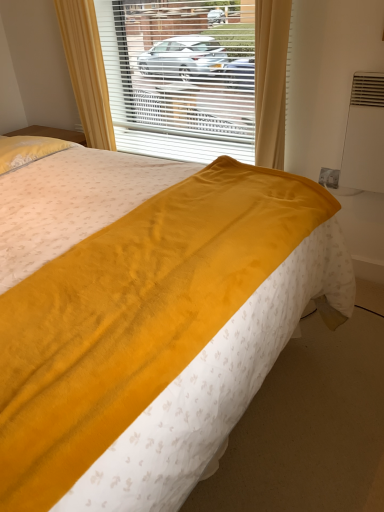
The height and width of the screenshot is (512, 384). What do you see at coordinates (146, 318) in the screenshot?
I see `velvet yellow blanket at center` at bounding box center [146, 318].

This screenshot has height=512, width=384. Identify the location of velvet yellow blanket at center. (146, 318).

This screenshot has width=384, height=512. What do you see at coordinates (271, 80) in the screenshot?
I see `white plastic blinds at center` at bounding box center [271, 80].

Find the location of a particular element. white plastic blinds at center is located at coordinates (271, 80).

The image size is (384, 512). I want to click on velvet yellow blanket at center, so click(x=146, y=318).

Would you say velvet yellow blanket at center is to the left or to the right of white plastic blinds at center in the picture?

velvet yellow blanket at center is positioned on white plastic blinds at center's left side.

Considering the positions of objects velvet yellow blanket at center and white plastic blinds at center in the image provided, who is in front, velvet yellow blanket at center or white plastic blinds at center?

velvet yellow blanket at center is in front.

Is point (101, 461) closer or farther from the camera than point (258, 61)?

Clearly, point (101, 461) is closer to the camera than point (258, 61).

From the image's perspective, is velvet yellow blanket at center under white plastic blinds at center?

Yes, from the image's perspective, velvet yellow blanket at center is below white plastic blinds at center.

From a real-world perspective, is velvet yellow blanket at center located beneath white plastic blinds at center?

Yes, from a real-world perspective, velvet yellow blanket at center is under white plastic blinds at center.

Between velvet yellow blanket at center and white plastic blinds at center, which one has smaller width?

Thinner between the two is white plastic blinds at center.

Considering the sizes of objects velvet yellow blanket at center and white plastic blinds at center in the image provided, who is taller, velvet yellow blanket at center or white plastic blinds at center?

With more height is velvet yellow blanket at center.

Does velvet yellow blanket at center have a smaller size compared to white plastic blinds at center?

No, velvet yellow blanket at center is not smaller than white plastic blinds at center.

Is velvet yellow blanket at center inside or outside of white plastic blinds at center?

velvet yellow blanket at center lies outside white plastic blinds at center.

Are velvet yellow blanket at center and white plastic blinds at center beside each other?

velvet yellow blanket at center is not next to white plastic blinds at center, and they're not touching.

Is velvet yellow blanket at center positioned with its back to white plastic blinds at center?

velvet yellow blanket at center does not have its back to white plastic blinds at center.

How many degrees apart are the facing directions of velvet yellow blanket at center and white plastic blinds at center?

The angle between the facing direction of velvet yellow blanket at center and the facing direction of white plastic blinds at center is 90 degrees.

Measure the distance between velvet yellow blanket at center and white plastic blinds at center.

The distance of velvet yellow blanket at center from white plastic blinds at center is 1.32 meters.

This screenshot has height=512, width=384. Identify the location of bed that appears below the white plastic blinds at center (from the image's perspective). (146, 318).

Does white plastic blinds at center appear on the left side of velvet yellow blanket at center?

Incorrect, white plastic blinds at center is not on the left side of velvet yellow blanket at center.

Which object is more forward, white plastic blinds at center or velvet yellow blanket at center?

velvet yellow blanket at center.

Does point (93, 87) lie behind point (209, 219)?

Yes.

From the image's perspective, is white plastic blinds at center above or below velvet yellow blanket at center?

Based on their image positions, white plastic blinds at center is located above velvet yellow blanket at center.

From a real-world perspective, relative to velvet yellow blanket at center, is white plastic blinds at center vertically above or below?

white plastic blinds at center is above velvet yellow blanket at center.

Which of these two, white plastic blinds at center or velvet yellow blanket at center, is thinner?

Thinner between the two is white plastic blinds at center.

In terms of height, does white plastic blinds at center look taller or shorter compared to velvet yellow blanket at center?

In the image, white plastic blinds at center appears to be shorter than velvet yellow blanket at center.

Which of these two, white plastic blinds at center or velvet yellow blanket at center, is smaller?

With smaller size is white plastic blinds at center.

Is white plastic blinds at center inside or outside of velvet yellow blanket at center?

white plastic blinds at center is not enclosed by velvet yellow blanket at center.

Is white plastic blinds at center not close to velvet yellow blanket at center?

Absolutely, white plastic blinds at center is distant from velvet yellow blanket at center.

In the scene shown: Is velvet yellow blanket at center at the back of white plastic blinds at center?

No.

How different are the orientations of white plastic blinds at center and velvet yellow blanket at center in degrees?

The angular difference between white plastic blinds at center and velvet yellow blanket at center is 90 degrees.

The image size is (384, 512). I want to click on bed located underneath the white plastic blinds at center (from a real-world perspective), so click(146, 318).

Locate an element on the screen. Image resolution: width=384 pixels, height=512 pixels. bed below the white plastic blinds at center (from the image's perspective) is located at coordinates (146, 318).

Where is `bed that is under the white plastic blinds at center (from a real-world perspective)`? bed that is under the white plastic blinds at center (from a real-world perspective) is located at coordinates (146, 318).